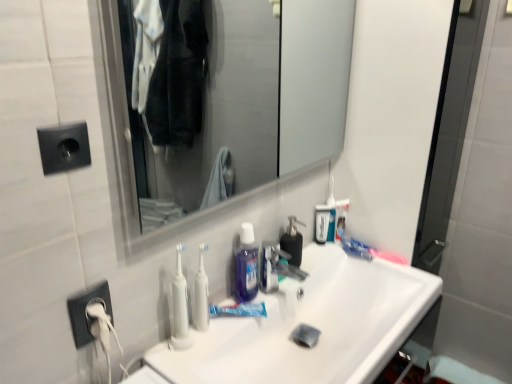
Identify the location of free space on the front side of white plastic toothpaste tube at upper right. The image size is (512, 384). (344, 253).